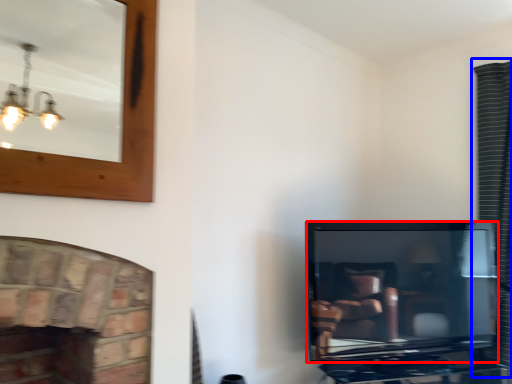
Question: Which object appears farthest to the camera in this image, television (highlighted by a red box) or curtain (highlighted by a blue box)?

Choices:
 (A) television
 (B) curtain

Answer: (B)